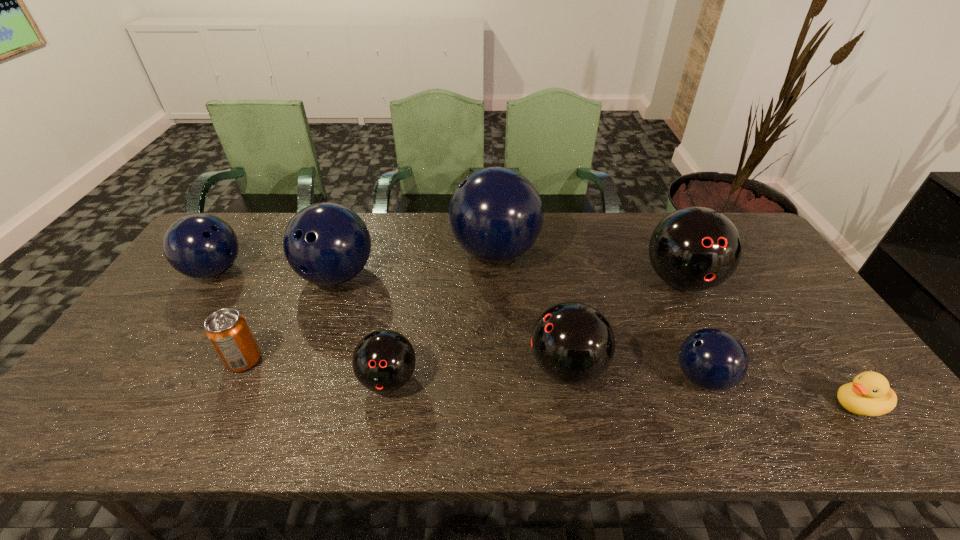
Locate an element on the screen. Image resolution: width=960 pixels, height=540 pixels. the fourth object from left to right is located at coordinates (383, 361).

You are a GUI agent. You are given a task and a screenshot of the screen. Output one action in this format:
    pyautogui.click(x=<x>, y=<y>)
    Task: Click on the smallest black bowling ball
    
    Given the screenshot: What is the action you would take?
    pyautogui.click(x=383, y=361)

What are the coordinates of `the nearest blue bowling ball` in the screenshot? It's located at (713, 359).

The width and height of the screenshot is (960, 540). What are the coordinates of `the smallest blue bowling ball` in the screenshot? It's located at (713, 359).

Find the location of a particular element. The image size is (960, 540). yellow duckling is located at coordinates (869, 394).

The width and height of the screenshot is (960, 540). Find the location of `the rightmost object`. the rightmost object is located at coordinates (869, 394).

Locate an element on the screen. The height and width of the screenshot is (540, 960). vacant region located 0.060m on the surface of the biggest blue bowling ball near the finger holes is located at coordinates (432, 252).

Find the location of `blank area located 0.360m on the surface of the biggest blue bowling ball near the finger holes`. blank area located 0.360m on the surface of the biggest blue bowling ball near the finger holes is located at coordinates (339, 252).

I want to click on vacant space located 0.330m on the surface of the biggest blue bowling ball near the finger holes, so (x=348, y=252).

The image size is (960, 540). In order to click on vacant region located on the surface of the biggest black bowling ball near the finger holes in this screenshot , I will do `click(713, 346)`.